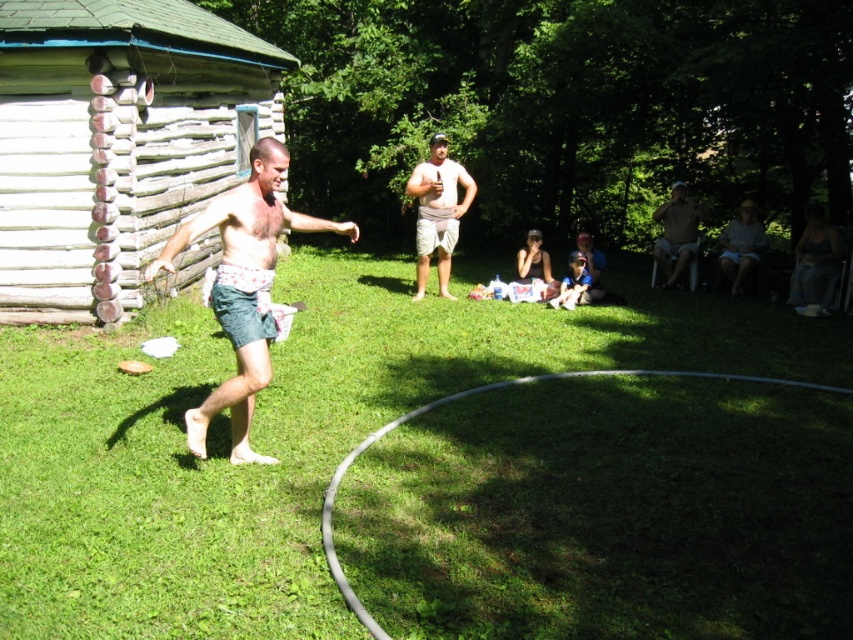
You are standing in the grassy yard and want to take a photo of the weathered wood log cabin at left. Which direction should you face to capture it in your camera view?

You should face towards the left direction to capture the weathered wood log cabin at left in your camera view since it is located at point (115, 141) which is on the left side of the scene.

You are planning to take a photo of the weathered wood log cabin at left and the blue denim shorts at lower center. Since you want both subjects to appear clearly in the frame, which object should you focus on first to ensure proper depth of field?

You should focus on the weathered wood log cabin at left first because it is larger in size compared to the blue denim shorts at lower center, ensuring both will be in focus when using depth of field techniques.

You are standing in the grassy yard and want to place a small picnic basket between the green grass at center and the denim shorts at lower right. Which object should the basket be closer to if it needs to be nearer to the viewer?

The picnic basket should be placed closer to the green grass at center because it is nearer to the viewer compared to the denim shorts at lower right.